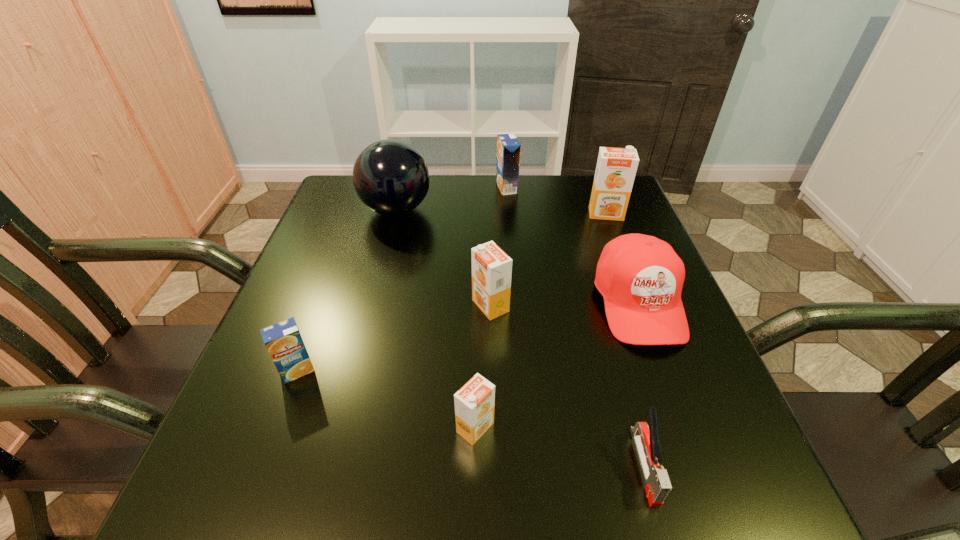
The height and width of the screenshot is (540, 960). In order to click on vacant space at the far edge of the desktop in this screenshot , I will do `click(521, 212)`.

Find the location of a particular element. free region at the near edge of the desktop is located at coordinates (588, 524).

Identify the location of vacant space at the left edge of the desktop. (319, 252).

At what (x,y) coordinates should I click in order to perform the action: click on free location at the right edge of the desktop. Please return your answer as a coordinate pair (x, y). This screenshot has width=960, height=540. Looking at the image, I should click on (615, 351).

Where is `free region at the far left corner of the desktop`? This screenshot has height=540, width=960. free region at the far left corner of the desktop is located at coordinates (331, 211).

What are the coordinates of `free space at the far right corner of the desktop` in the screenshot? It's located at (574, 190).

Where is `vacant region at the near right corner of the desktop`? This screenshot has height=540, width=960. vacant region at the near right corner of the desktop is located at coordinates tap(702, 492).

The height and width of the screenshot is (540, 960). Identify the location of free space between the farther blue orange_juice and the third nearest object. (402, 279).

Identify the location of free area in between the gray stapler and the baseball cap. (641, 384).

You are a GUI agent. You are given a task and a screenshot of the screen. Output one action in this format:
    pyautogui.click(x=<x>, y=<y>)
    Task: Click on the vacant area that lies between the second biggest orange orange juice and the stapler
    The height and width of the screenshot is (540, 960).
    Given the screenshot: What is the action you would take?
    pyautogui.click(x=567, y=386)